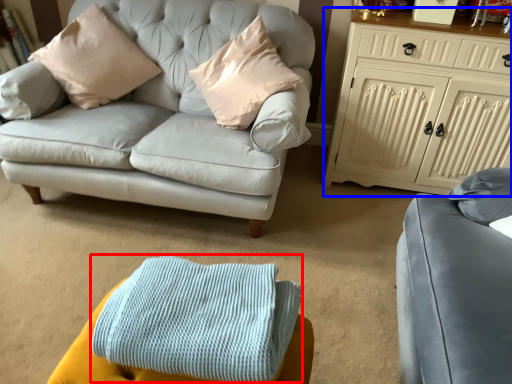
Question: Which of the following is the farthest to the observer, blanket (highlighted by a red box) or cabinetry (highlighted by a blue box)?

Choices:
 (A) blanket
 (B) cabinetry

Answer: (B)